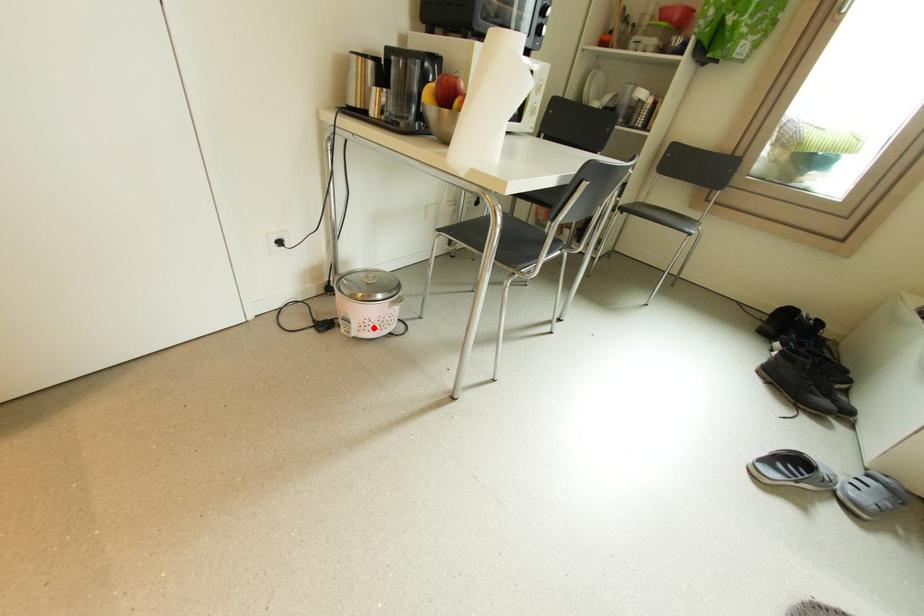
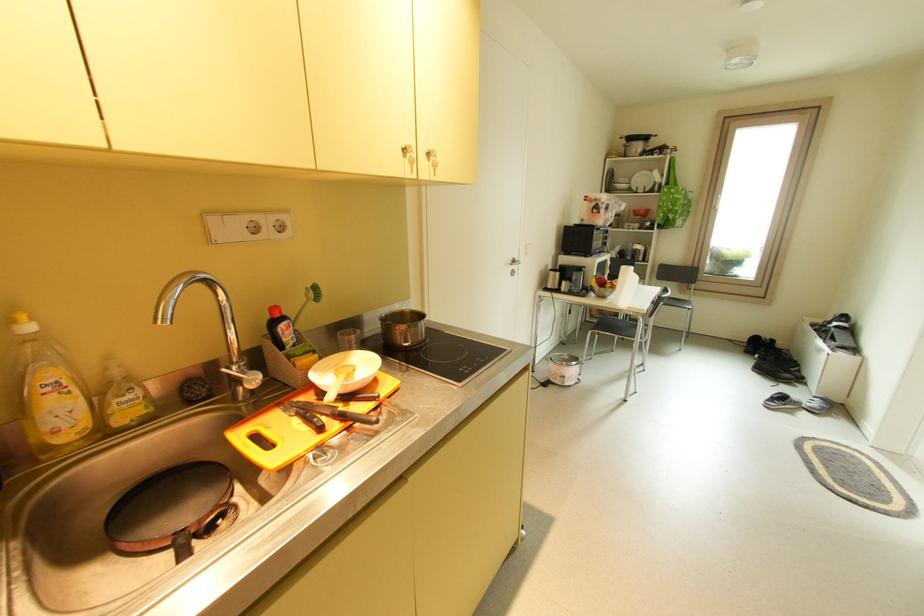
Where in the second image is the point corresponding to the highlighted location from the first image?

(578, 379)